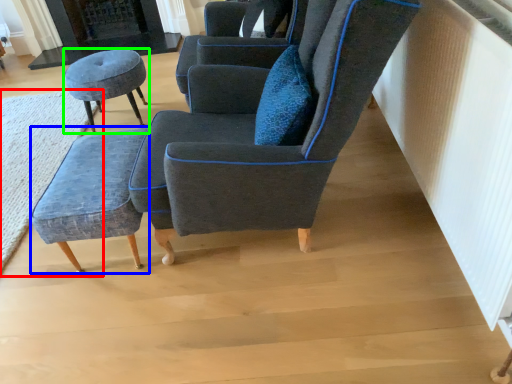
Question: Estimate the real-world distances between objects in this image. Which object is farther from mat (highlighted by a red box), stool (highlighted by a blue box) or stool (highlighted by a green box)?

Choices:
 (A) stool
 (B) stool

Answer: (A)